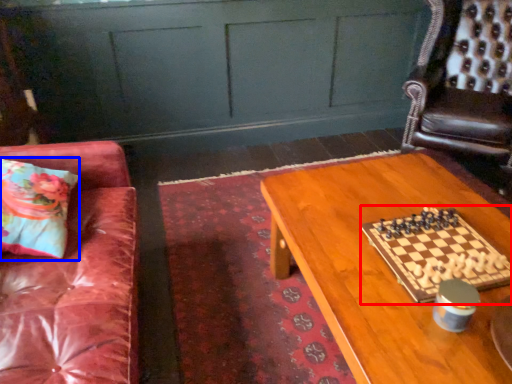
Question: Which of the following is the farthest to the observer, board game (highlighted by a red box) or pillow (highlighted by a blue box)?

Choices:
 (A) board game
 (B) pillow

Answer: (B)